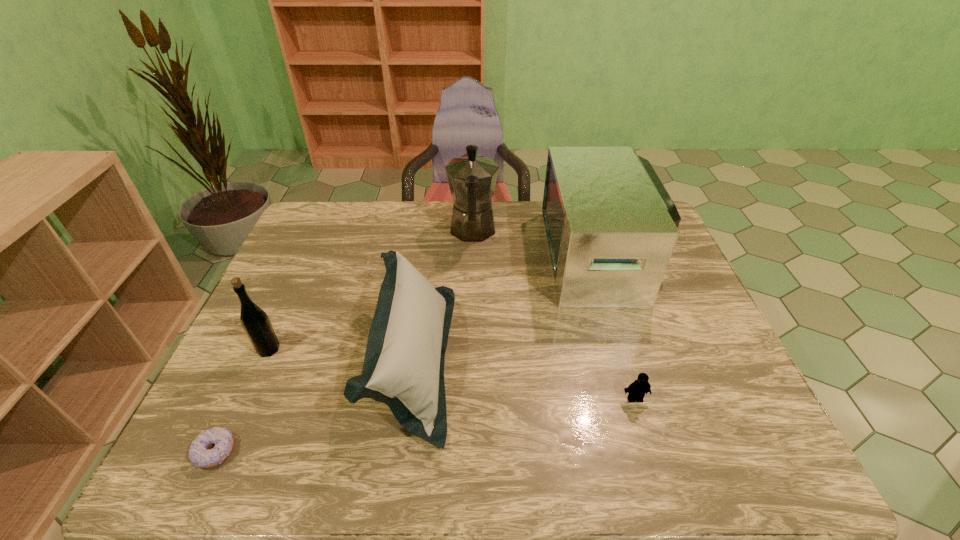
Locate an element on the screen. This screenshot has height=540, width=960. doughnut present at the left edge is located at coordinates (198, 454).

Where is `object that is at the right edge`? This screenshot has width=960, height=540. object that is at the right edge is located at coordinates (611, 227).

This screenshot has height=540, width=960. In order to click on object that is at the near left corner in this screenshot , I will do `click(198, 454)`.

What are the coordinates of `object that is at the far right corner` in the screenshot? It's located at (611, 227).

Locate an element on the screen. Image resolution: width=960 pixels, height=540 pixels. free region at the far edge is located at coordinates (447, 227).

Image resolution: width=960 pixels, height=540 pixels. I want to click on vacant space at the near edge of the desktop, so click(x=640, y=465).

Where is `free region at the left edge of the desktop`? free region at the left edge of the desktop is located at coordinates (209, 421).

Where is `vacant region at the right edge of the desktop`? The image size is (960, 540). vacant region at the right edge of the desktop is located at coordinates (703, 327).

Identify the location of free location at the far left corner. The image size is (960, 540). (312, 219).

This screenshot has width=960, height=540. I want to click on unoccupied area between the beer bottle and the fourth tallest object, so click(341, 354).